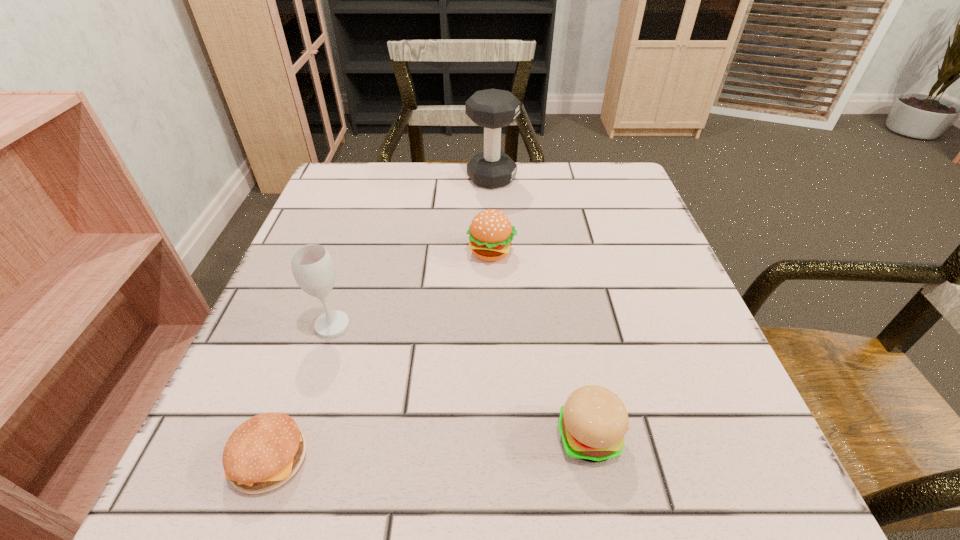
The width and height of the screenshot is (960, 540). Identify the location of free space located on the right of the dumbbell. (604, 178).

Where is `vacant space located 0.210m on the back of the fourth shortest object`? This screenshot has height=540, width=960. vacant space located 0.210m on the back of the fourth shortest object is located at coordinates click(x=360, y=238).

Identify the location of blank space located 0.180m on the left of the farthest hamburger. The height and width of the screenshot is (540, 960). (378, 252).

I want to click on blank area located on the back of the second shortest hamburger, so click(557, 266).

What are the coordinates of `vacant space located on the right of the shortest object` in the screenshot? It's located at (602, 458).

This screenshot has height=540, width=960. In order to click on object that is at the far edge in this screenshot , I will do `click(492, 109)`.

At what (x,y) coordinates should I click in order to perform the action: click on wineglass that is positioned at the left edge. Please return your answer as a coordinate pair (x, y). The image size is (960, 540). Looking at the image, I should click on (313, 269).

You are a GUI agent. You are given a task and a screenshot of the screen. Output one action in this format:
    pyautogui.click(x=<x>, y=<y>)
    Task: Click on the hamburger located at the left edge
    
    Given the screenshot: What is the action you would take?
    pyautogui.click(x=265, y=451)

In order to click on object present at the near left corner in this screenshot , I will do `click(265, 451)`.

Locate an element on the screen. This screenshot has width=960, height=540. blank space at the far edge of the desktop is located at coordinates (535, 187).